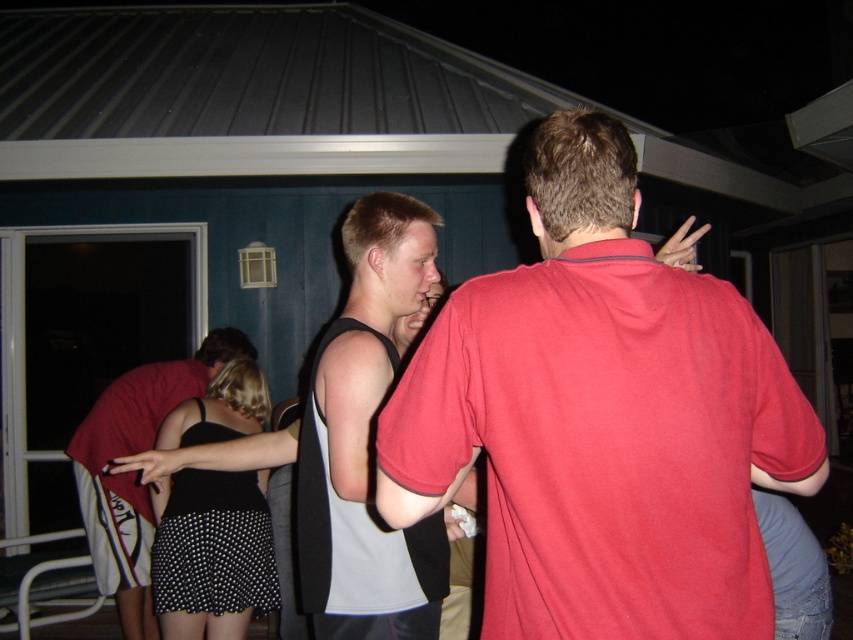
Question: Can you confirm if matte red shirt at center is positioned above black sleeveless shirt at center?

Choices:
 (A) yes
 (B) no

Answer: (A)

Question: Is gray matte tank top at center further to the viewer compared to black dotted skirt at lower left?

Choices:
 (A) yes
 (B) no

Answer: (B)

Question: Which object is positioned closest to the gray matte tank top at center?

Choices:
 (A) black sleeveless shirt at center
 (B) matte red shirt at center

Answer: (B)

Question: Which object is positioned farthest from the black sleeveless shirt at center?

Choices:
 (A) gray matte tank top at center
 (B) black dotted skirt at lower left

Answer: (A)

Question: Which point appears farthest from the camera in this image?

Choices:
 (A) (262, 404)
 (B) (113, 381)

Answer: (B)

Question: Can you confirm if black dotted skirt at lower left is bigger than black sleeveless shirt at center?

Choices:
 (A) no
 (B) yes

Answer: (A)